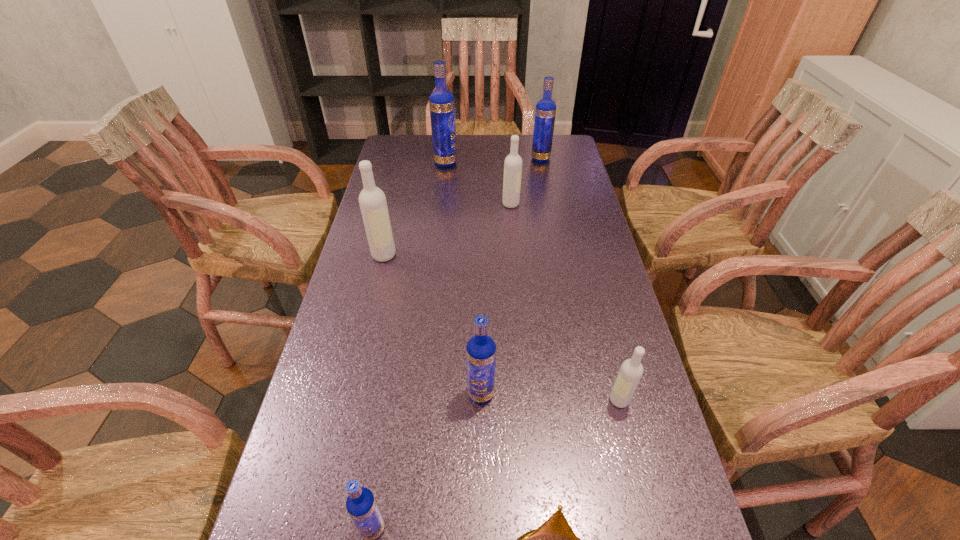
I want to click on the third closest vodka relative to the third smallest blue vodka, so click(372, 200).

Identify the location of vodka identified as the closest to the second smallest blue vodka. The image size is (960, 540). (630, 373).

Locate an element on the screen. blue vodka that can be found as the third closest to the leftmost vodka is located at coordinates (545, 112).

Identify which blue vodka is the second closest to the biggest blue vodka. Please provide its 2D coordinates. Your answer should be formatted as a tuple, i.e. [(x, y)], where the tuple contains the x and y coordinates of a point satisfying the conditions above.

[(481, 349)]

Identify which white vodka is the nearest to the shortest object. Please provide its 2D coordinates. Your answer should be formatted as a tuple, i.e. [(x, y)], where the tuple contains the x and y coordinates of a point satisfying the conditions above.

[(630, 373)]

The height and width of the screenshot is (540, 960). Find the location of `white vodka identified as the third closest to the tallest vodka`. white vodka identified as the third closest to the tallest vodka is located at coordinates (630, 373).

I want to click on vacant region that satisfies the following two spatial constraints: 1. on the back side of the third farthest object; 2. on the right side of the rightmost blue vodka, so pyautogui.click(x=507, y=159).

Find the location of `free space that satisfies the following two spatial constraints: 1. on the front side of the second white vodka from right to left; 2. on the left side of the tallest vodka`. free space that satisfies the following two spatial constraints: 1. on the front side of the second white vodka from right to left; 2. on the left side of the tallest vodka is located at coordinates (441, 204).